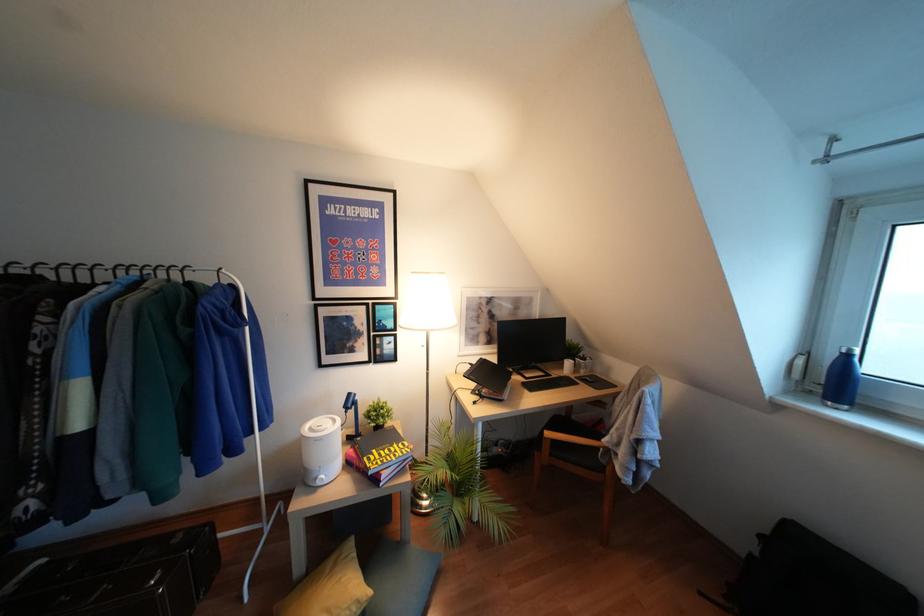
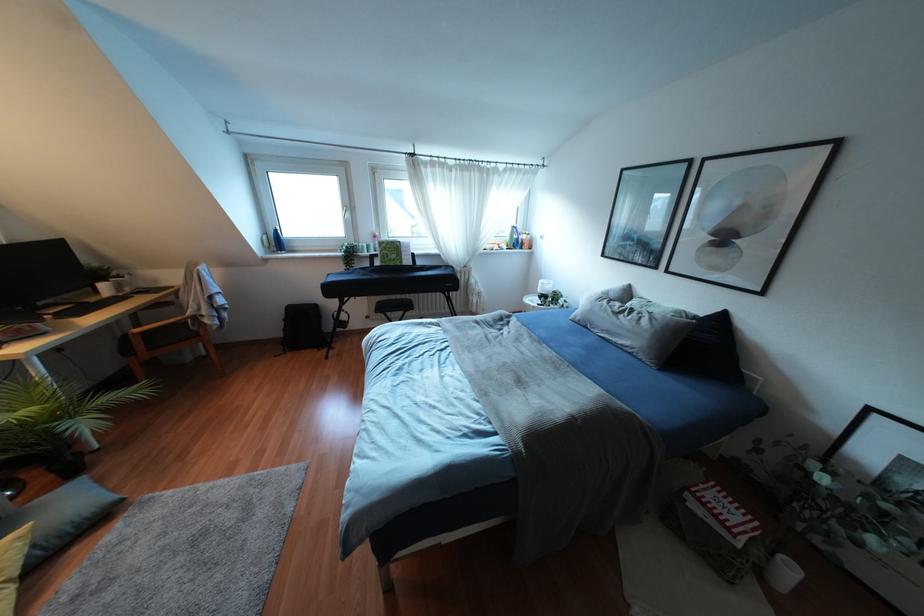
Find the pixel in the second image that matches the point at 749,554 in the first image.

(284, 329)